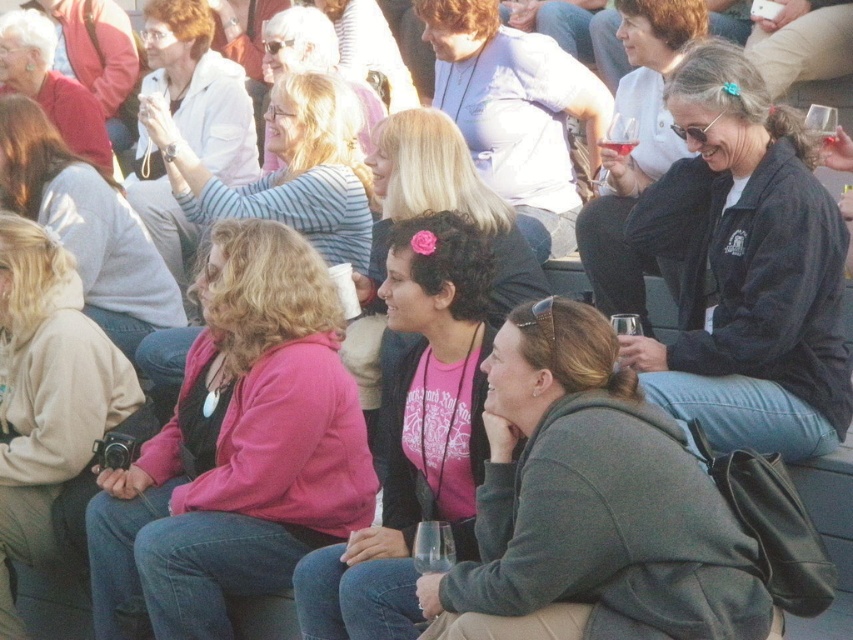
You are a photographer at the event and want to capture a photo of the pink fleece jacket at center and the light gray hoodie at center. Which clothing item should you focus on first if you want to ensure both are in frame without adjusting your camera angle?

The pink fleece jacket at center is taller than the light gray hoodie at center, so you should focus on the pink fleece jacket at center first to ensure both are in frame without adjusting your camera angle.

You are standing at the event and want to take a photo of the pink fleece jacket at center. If your camera has a maximum focus range of 30 feet, will you be able to capture a clear photo?

The pink fleece jacket at center is 34.88 feet away from the viewer. Since the camera can only focus up to 30 feet, it won t be able to capture a clear photo.